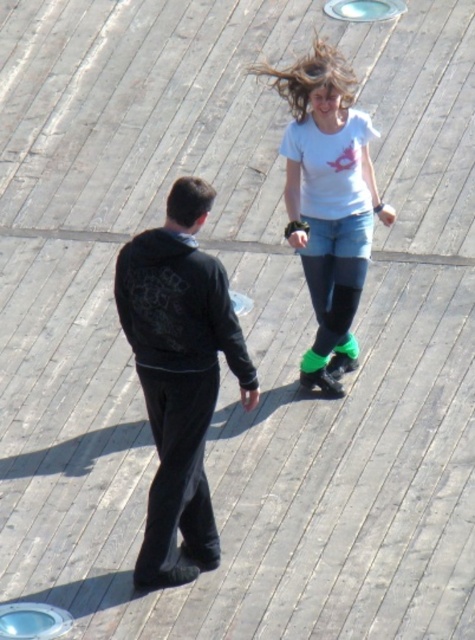
Question: Observing the image, what is the correct spatial positioning of black matte jacket at center in reference to green fabric sock at center?

Choices:
 (A) right
 (B) left

Answer: (B)

Question: Does black matte jacket at center appear on the right side of white matte t-shirt at upper center?

Choices:
 (A) yes
 (B) no

Answer: (B)

Question: Which object is closer to the camera taking this photo?

Choices:
 (A) white matte t-shirt at upper center
 (B) black matte jacket at center

Answer: (B)

Question: Estimate the real-world distances between objects in this image. Which object is farther from the green fabric sock at center?

Choices:
 (A) white matte t-shirt at upper center
 (B) black matte jacket at center

Answer: (B)

Question: Is black matte jacket at center further to the viewer compared to green fabric sock at center?

Choices:
 (A) yes
 (B) no

Answer: (B)

Question: Which object is closer to the camera taking this photo?

Choices:
 (A) black matte jacket at center
 (B) white matte t-shirt at upper center

Answer: (A)